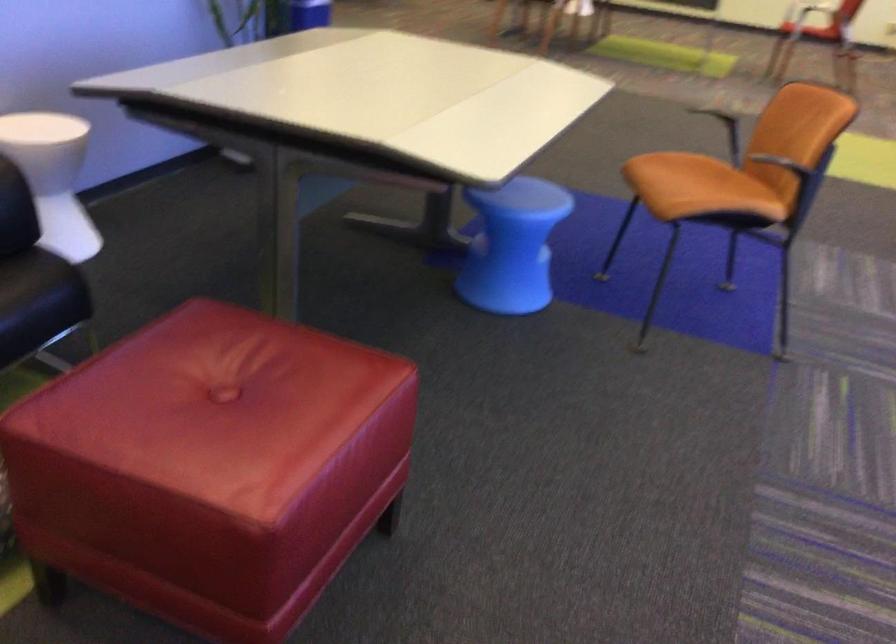
Where is `blue plastic stool`? The width and height of the screenshot is (896, 644). blue plastic stool is located at coordinates (512, 245).